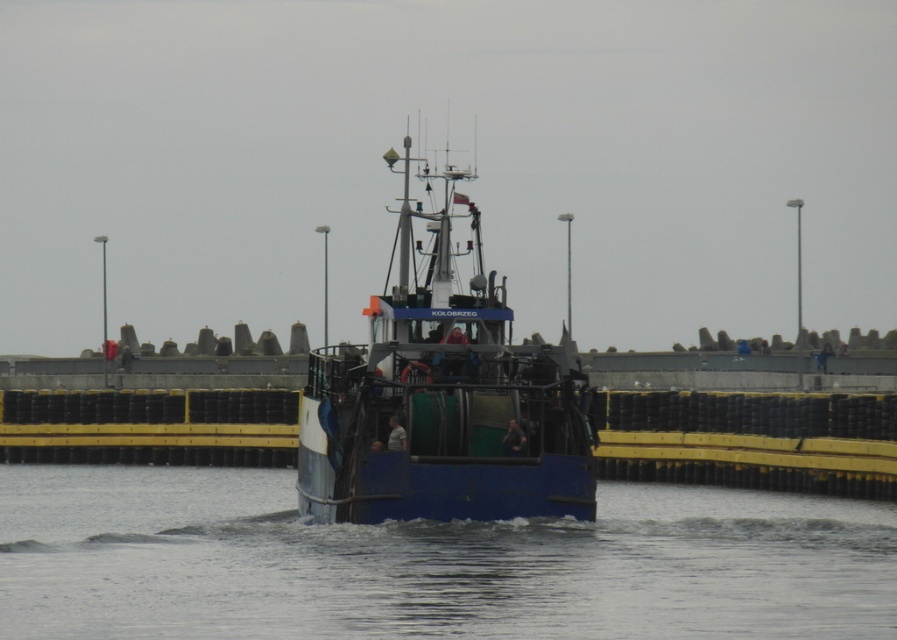
Can you confirm if blue water at center is positioned to the right of blue matte boat at center?

No, blue water at center is not to the right of blue matte boat at center.

Which is more to the left, blue water at center or blue matte boat at center?

blue water at center

Which is in front, point (57, 618) or point (407, 474)?

Point (57, 618) is more forward.

What are the coordinates of `blue water at center` in the screenshot? It's located at click(429, 563).